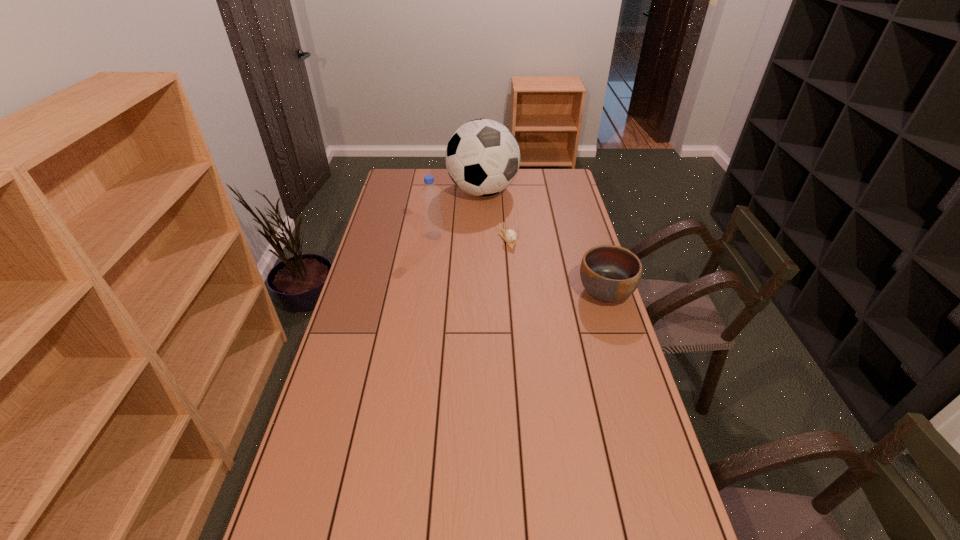
Find the location of a particular element. empty location between the bottle and the farthest object is located at coordinates (458, 213).

Locate an element on the screen. This screenshot has width=960, height=540. empty space that is in between the third shortest object and the escargot is located at coordinates (470, 238).

The width and height of the screenshot is (960, 540). Identify the location of object that is the closest one to the second tallest object. (482, 157).

The height and width of the screenshot is (540, 960). I want to click on the closest object to the shortest object, so click(x=482, y=157).

In order to click on free point that satisfies the following two spatial constraints: 1. on the back side of the farthest object; 2. on the left side of the bottle in this screenshot , I will do `click(440, 191)`.

The height and width of the screenshot is (540, 960). Find the location of `vacant area in the image that satisfies the following two spatial constraints: 1. on the front side of the second tallest object; 2. on the left side of the shortest object`. vacant area in the image that satisfies the following two spatial constraints: 1. on the front side of the second tallest object; 2. on the left side of the shortest object is located at coordinates (433, 240).